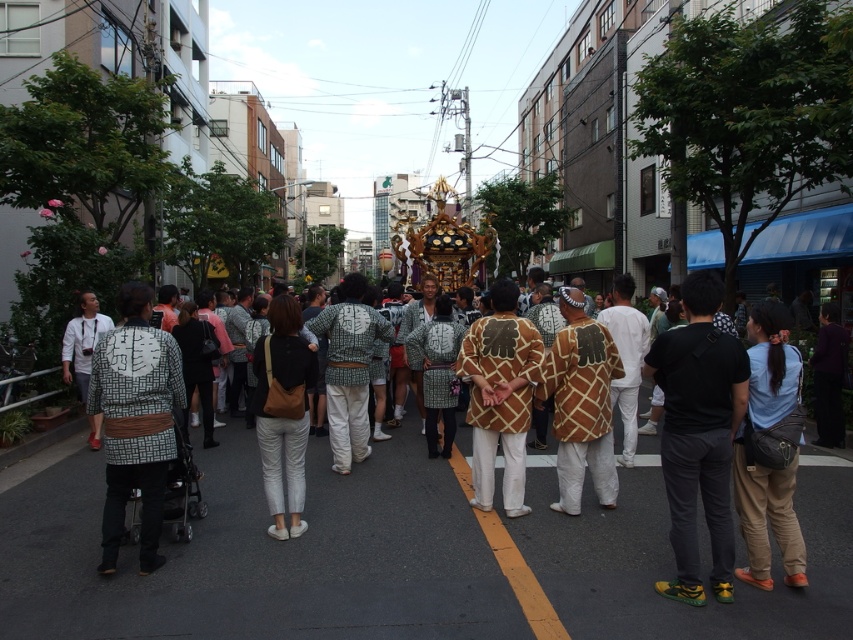
Can you confirm if blue cotton shirt at lower right is shorter than green woven fabric at center?

Indeed, blue cotton shirt at lower right has a lesser height compared to green woven fabric at center.

Is blue cotton shirt at lower right thinner than green woven fabric at center?

Yes.

Between point (790, 429) and point (432, 387), which one is positioned behind?

The point (432, 387) is more distant.

Identify the location of blue cotton shirt at lower right. (769, 451).

Who is taller, patterned fabric kimono at left or green checkered kimono at center?

Standing taller between the two is green checkered kimono at center.

Who is lower down, patterned fabric kimono at left or green checkered kimono at center?

patterned fabric kimono at left

Does point (154, 442) come farther from viewer compared to point (361, 288)?

No, it is not.

The height and width of the screenshot is (640, 853). What are the coordinates of `patterned fabric kimono at left` in the screenshot? It's located at (135, 420).

Can you confirm if blue cotton shirt at lower right is wider than brown woven fabric kimono at center?

No.

Find the location of a particular element. The height and width of the screenshot is (640, 853). blue cotton shirt at lower right is located at coordinates (769, 451).

Where is `blue cotton shirt at lower right`? blue cotton shirt at lower right is located at coordinates (769, 451).